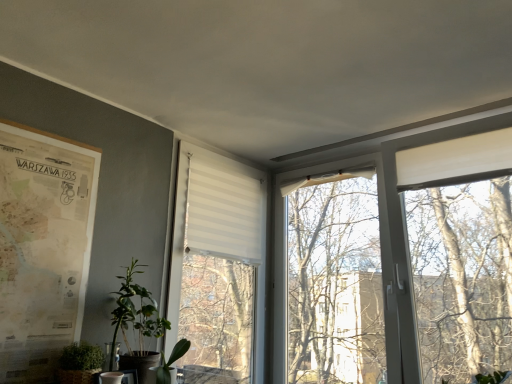
Question: Is green matte plant at lower center, which is the first houseplant in right-to-left order, behind beige paper map at left?

Choices:
 (A) no
 (B) yes

Answer: (B)

Question: Is green matte plant at lower center, acting as the 3th houseplant starting from the left, positioned with its back to beige paper map at left?

Choices:
 (A) no
 (B) yes

Answer: (A)

Question: Can you confirm if green matte plant at lower center, acting as the 3th houseplant starting from the left, is thinner than beige paper map at left?

Choices:
 (A) yes
 (B) no

Answer: (B)

Question: From the image's perspective, is green matte plant at lower center, acting as the 3th houseplant starting from the left, on top of beige paper map at left?

Choices:
 (A) yes
 (B) no

Answer: (B)

Question: Would you consider green matte plant at lower center, acting as the 3th houseplant starting from the left, to be distant from beige paper map at left?

Choices:
 (A) no
 (B) yes

Answer: (A)

Question: Considering their positions, is beige paper map at left located in front of or behind green matte plant at lower center, acting as the 3th houseplant starting from the left?

Choices:
 (A) behind
 (B) front

Answer: (B)

Question: Considering the positions of beige paper map at left and green matte plant at lower center, which is the first houseplant in right-to-left order, in the image, is beige paper map at left taller or shorter than green matte plant at lower center, which is the first houseplant in right-to-left order,?

Choices:
 (A) short
 (B) tall

Answer: (B)

Question: From a real-world perspective, is beige paper map at left positioned above or below green matte plant at lower center, acting as the 3th houseplant starting from the left?

Choices:
 (A) below
 (B) above

Answer: (B)

Question: In terms of width, does beige paper map at left look wider or thinner when compared to green matte plant at lower center, which is the first houseplant in right-to-left order?

Choices:
 (A) thin
 (B) wide

Answer: (A)

Question: Which is correct: beige paper map at left is inside green matte plant at lower left, the 3th houseplant when ordered from right to left, or outside of it?

Choices:
 (A) outside
 (B) inside

Answer: (A)

Question: Considering the positions of beige paper map at left and green matte plant at lower left, arranged as the first houseplant when viewed from the left, in the image, is beige paper map at left bigger or smaller than green matte plant at lower left, arranged as the first houseplant when viewed from the left,?

Choices:
 (A) small
 (B) big

Answer: (B)

Question: In the image, is beige paper map at left positioned in front of or behind green matte plant at lower left, arranged as the first houseplant when viewed from the left?

Choices:
 (A) behind
 (B) front

Answer: (B)

Question: Would you say beige paper map at left is to the left or to the right of green matte plant at lower left, the 3th houseplant when ordered from right to left, in the picture?

Choices:
 (A) right
 (B) left

Answer: (B)

Question: From the image's perspective, is beige paper map at left positioned above or below white striped fabric at center?

Choices:
 (A) above
 (B) below

Answer: (A)

Question: Relative to white striped fabric at center, is beige paper map at left in front or behind?

Choices:
 (A) behind
 (B) front

Answer: (B)